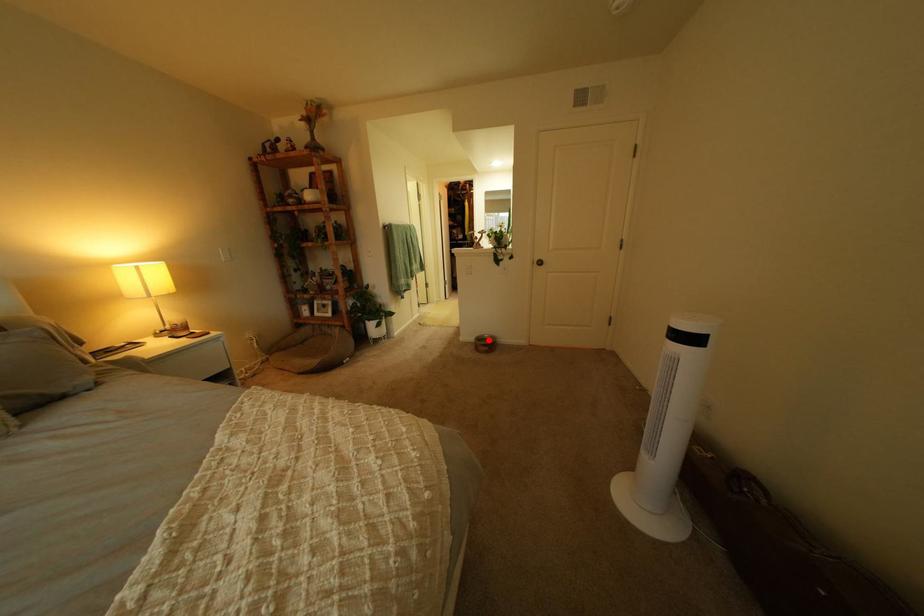
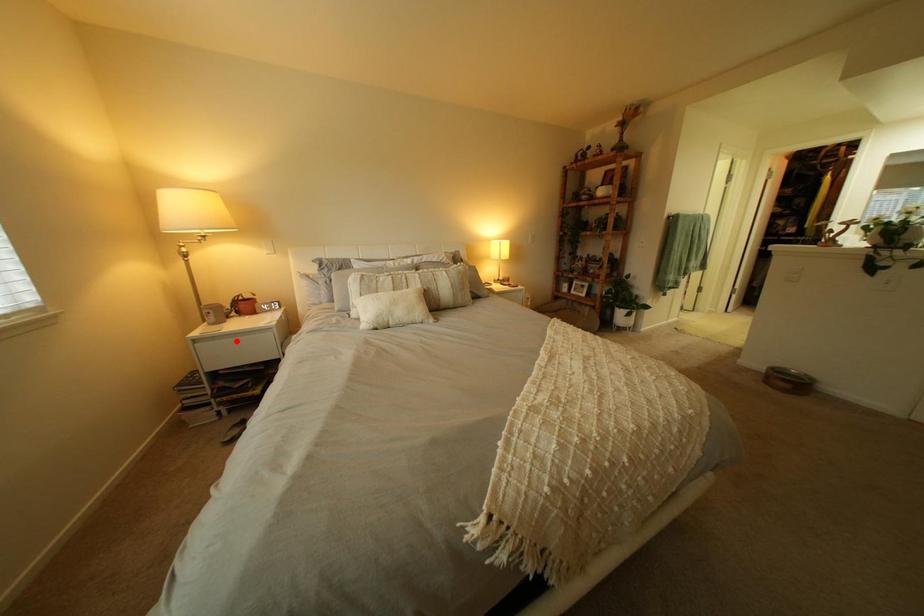
I am providing you with two images of the same scene from different viewpoints. A red point is marked on the first image and another point is marked on the second image. Are the points marked in image1 and image2 representing the same 3D position?

No